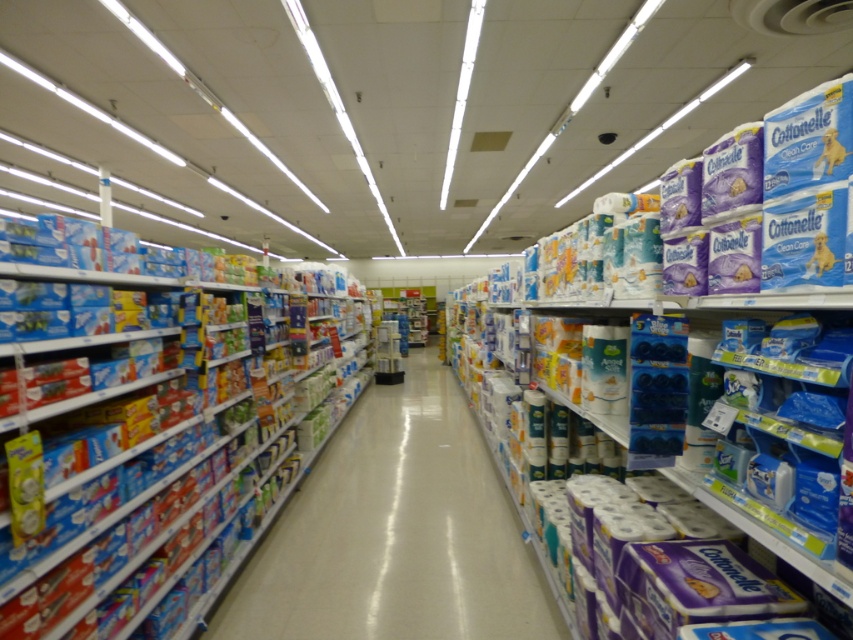
You are a supermarket employee who needs to restock the white paper towels at center and the blue cardboard boxes at left. Given their sizes, which item should you place first in the storage area to maximize space efficiency?

The white paper towels at center occupies less space than blue cardboard boxes at left, so you should place the blue cardboard boxes at left first to maximize space efficiency.

You are a supermarket employee who needs to restock the shelves. You have a new package of white paper towels at right and blue cardboard boxes at left. The shelf you are restocking has a width of 1.2 meters. Can you place both items side by side on the shelf without overlapping?

The white paper towels at right might be wider than blue cardboard boxes at left. If the combined width of both items exceeds 1.2 meters, they cannot be placed side by side. However, since their exact widths aren

You are a customer in the supermarket and want to grab the white paper towels at right and white paper towels at center. Which one is easier to reach without moving your current position?

The white paper towels at right is closer to the viewer, so it is easier to reach without moving your current position.